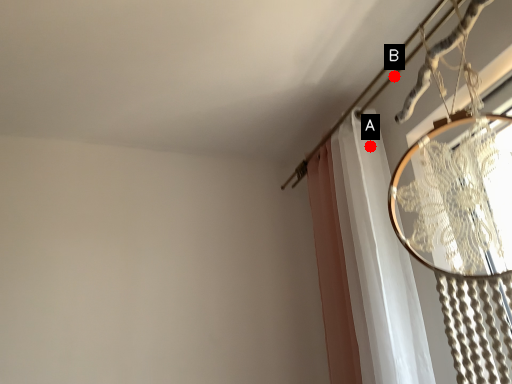
Question: Two points are circled on the image, labeled by A and B beside each circle. Which point is closer to the camera?

Choices:
 (A) A is closer
 (B) B is closer

Answer: (A)